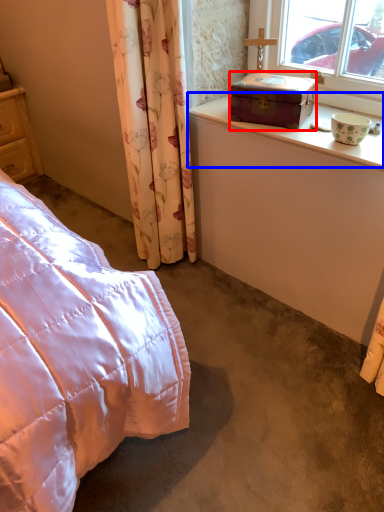
Question: Among these objects, which one is farthest to the camera, box (highlighted by a red box) or window sill (highlighted by a blue box)?

Choices:
 (A) box
 (B) window sill

Answer: (A)